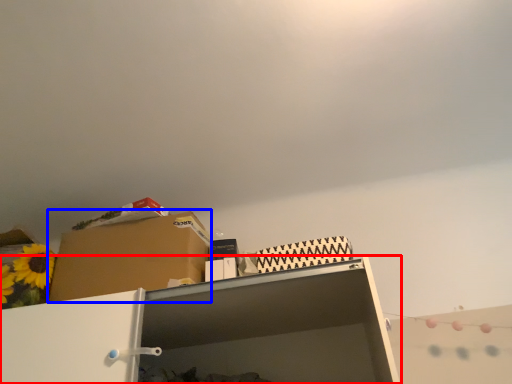
Question: Which point is further to the camera, shelf (highlighted by a red box) or cardboard box (highlighted by a blue box)?

Choices:
 (A) shelf
 (B) cardboard box

Answer: (B)